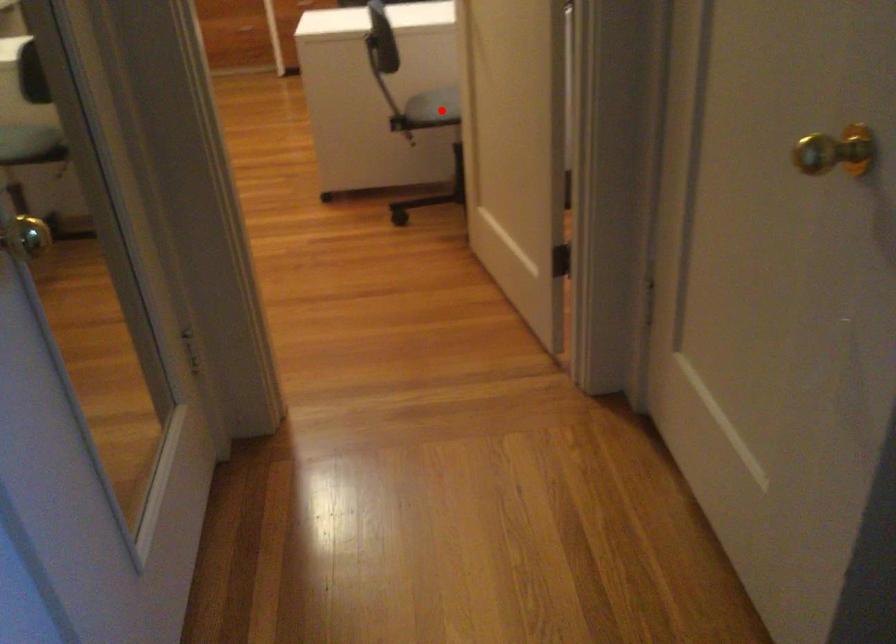
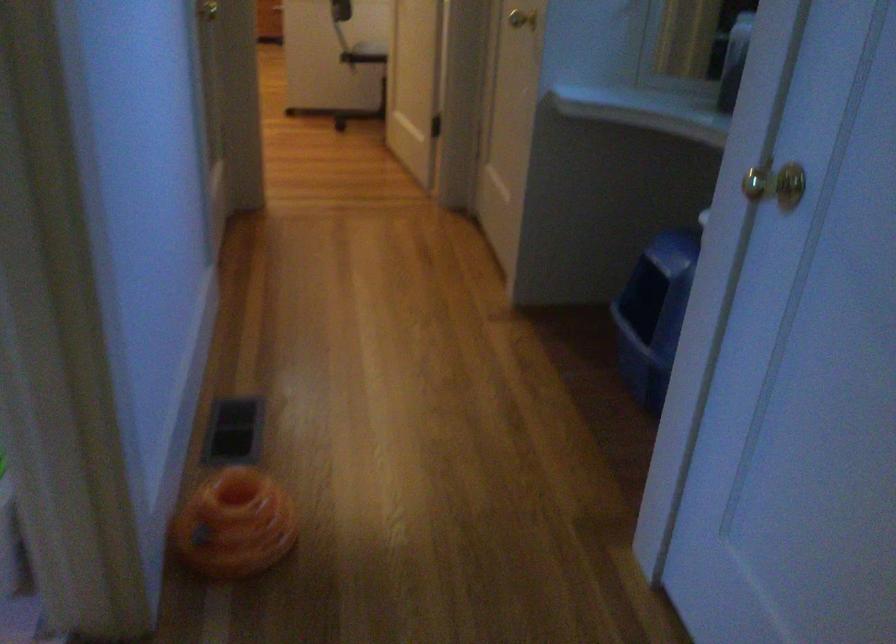
The point at the highlighted location is marked in the first image. Where is the corresponding point in the second image?

(371, 49)